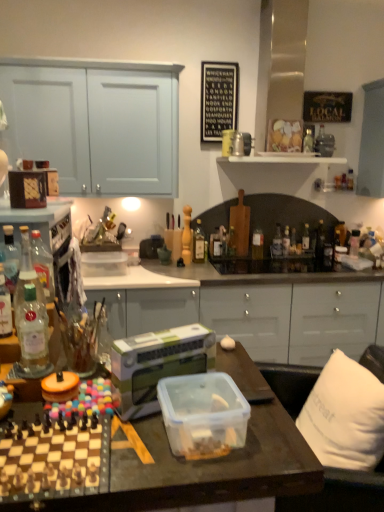
At what (x,y) coordinates should I click in order to perform the action: click on empty space that is to the right of translucent glass bottle at center, arranged as the 9th bottle when viewed from the front. Please return your answer as a coordinate pair (x, y). The height and width of the screenshot is (512, 384). Looking at the image, I should click on (296, 262).